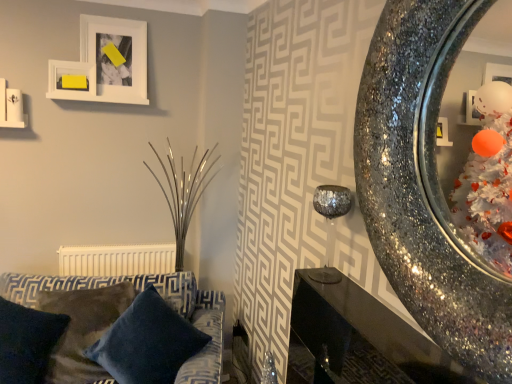
Question: Would you say yellow paper at upper left, acting as the 1th picture frame starting from the left, contains sparkly metallic mirror at right?

Choices:
 (A) yes
 (B) no

Answer: (B)

Question: Is yellow paper at upper left, acting as the 1th picture frame starting from the left, outside of sparkly metallic mirror at right?

Choices:
 (A) yes
 (B) no

Answer: (A)

Question: Is yellow paper at upper left, acting as the 1th picture frame starting from the left, smaller than sparkly metallic mirror at right?

Choices:
 (A) yes
 (B) no

Answer: (A)

Question: From the image's perspective, is yellow paper at upper left, which is the 2th picture frame in right-to-left order, beneath sparkly metallic mirror at right?

Choices:
 (A) yes
 (B) no

Answer: (B)

Question: Is yellow paper at upper left, which is the 2th picture frame in right-to-left order, shorter than sparkly metallic mirror at right?

Choices:
 (A) no
 (B) yes

Answer: (B)

Question: Considering the positions of sparkly metallic mirror at right and velvety dark blue pillow at lower left in the image, is sparkly metallic mirror at right taller or shorter than velvety dark blue pillow at lower left?

Choices:
 (A) short
 (B) tall

Answer: (B)

Question: Is sparkly metallic mirror at right inside the boundaries of velvety dark blue pillow at lower left, or outside?

Choices:
 (A) outside
 (B) inside

Answer: (A)

Question: Considering the relative positions of sparkly metallic mirror at right and velvety dark blue pillow at lower left in the image provided, is sparkly metallic mirror at right to the left or to the right of velvety dark blue pillow at lower left?

Choices:
 (A) left
 (B) right

Answer: (B)

Question: From the image's perspective, is sparkly metallic mirror at right located above or below velvety dark blue pillow at lower left?

Choices:
 (A) below
 (B) above

Answer: (B)

Question: In the image, is sparkly metallic mirror at right on the left side or the right side of white matte picture frame at upper left, arranged as the 2th picture frame when viewed from the left?

Choices:
 (A) left
 (B) right

Answer: (B)

Question: Do you think sparkly metallic mirror at right is within white matte picture frame at upper left, arranged as the 2th picture frame when viewed from the left, or outside of it?

Choices:
 (A) inside
 (B) outside

Answer: (B)

Question: In terms of width, does sparkly metallic mirror at right look wider or thinner when compared to white matte picture frame at upper left, arranged as the 2th picture frame when viewed from the left?

Choices:
 (A) thin
 (B) wide

Answer: (B)

Question: In terms of size, does sparkly metallic mirror at right appear bigger or smaller than white matte picture frame at upper left, arranged as the 2th picture frame when viewed from the left?

Choices:
 (A) small
 (B) big

Answer: (B)

Question: Is point (44, 362) positioned closer to the camera than point (166, 263)?

Choices:
 (A) closer
 (B) farther

Answer: (A)

Question: From a real-world perspective, is velvety dark blue pillow at lower left physically located above or below white matte radiator at lower left?

Choices:
 (A) above
 (B) below

Answer: (B)